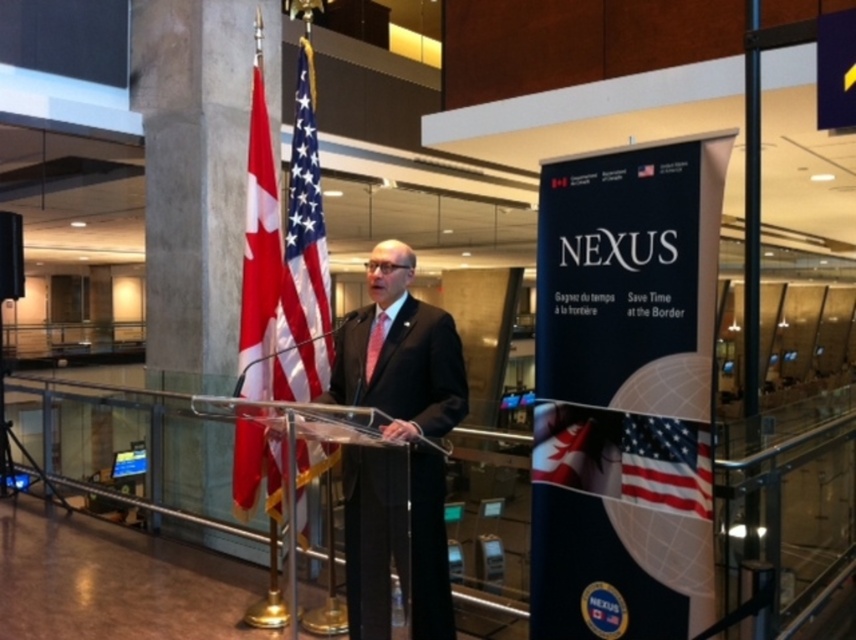
Is red fabric flag at left below matte red tie at center?

No, red fabric flag at left is not below matte red tie at center.

Does red fabric flag at left have a larger size compared to matte red tie at center?

Yes, red fabric flag at left is bigger than matte red tie at center.

The height and width of the screenshot is (640, 856). What do you see at coordinates (259, 250) in the screenshot?
I see `red fabric flag at left` at bounding box center [259, 250].

You are a GUI agent. You are given a task and a screenshot of the screen. Output one action in this format:
    pyautogui.click(x=<x>, y=<y>)
    Task: Click on the red fabric flag at left
    This screenshot has height=640, width=856.
    Given the screenshot: What is the action you would take?
    pyautogui.click(x=259, y=250)

Who is positioned more to the right, black suit at center or polyester flag at center?

black suit at center is more to the right.

This screenshot has width=856, height=640. What do you see at coordinates (395, 540) in the screenshot? I see `black suit at center` at bounding box center [395, 540].

At what (x,y) coordinates should I click in order to perform the action: click on black suit at center. Please return your answer as a coordinate pair (x, y). This screenshot has width=856, height=640. Looking at the image, I should click on (395, 540).

From the picture: Does black suit at center appear on the right side of red fabric flag at left?

Indeed, black suit at center is positioned on the right side of red fabric flag at left.

Is point (363, 358) positioned after point (260, 68)?

No, (363, 358) is closer to viewer.

I want to click on black suit at center, so click(x=395, y=540).